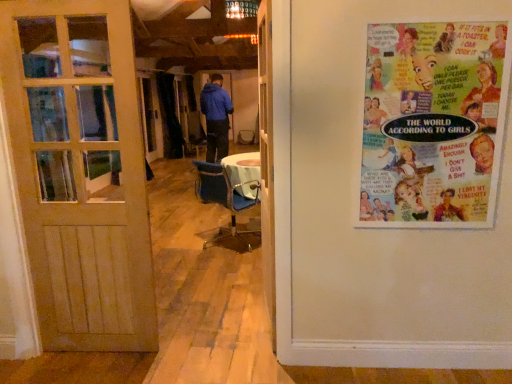
Question: Is blue fabric chair at center with white wooden door at center, acting as the 2th door starting from the left?

Choices:
 (A) yes
 (B) no

Answer: (B)

Question: Does blue fabric chair at center appear on the left side of white wooden door at center, the first door from the right?

Choices:
 (A) yes
 (B) no

Answer: (A)

Question: Could you tell me if blue fabric chair at center is facing white wooden door at center, acting as the 2th door starting from the left?

Choices:
 (A) no
 (B) yes

Answer: (A)

Question: Considering the relative positions of blue fabric chair at center and white wooden door at center, the first door from the right, in the image provided, is blue fabric chair at center to the right of white wooden door at center, the first door from the right, from the viewer's perspective?

Choices:
 (A) yes
 (B) no

Answer: (B)

Question: Is blue fabric chair at center wider than white wooden door at center, acting as the 2th door starting from the left?

Choices:
 (A) yes
 (B) no

Answer: (A)

Question: Is point (34, 175) positioned closer to the camera than point (243, 208)?

Choices:
 (A) closer
 (B) farther

Answer: (A)

Question: Based on their sizes in the image, would you say wooden door at left, which is the 1th door in left-to-right order, is bigger or smaller than blue fabric chair at center?

Choices:
 (A) big
 (B) small

Answer: (B)

Question: From the image's perspective, is wooden door at left, placed as the second door when sorted from right to left, located above or below blue fabric chair at center?

Choices:
 (A) below
 (B) above

Answer: (B)

Question: Is wooden door at left, placed as the second door when sorted from right to left, wider or thinner than blue fabric chair at center?

Choices:
 (A) wide
 (B) thin

Answer: (B)

Question: From a real-world perspective, relative to white wooden door at center, acting as the 2th door starting from the left, is wooden door at left, placed as the second door when sorted from right to left, vertically above or below?

Choices:
 (A) above
 (B) below

Answer: (B)

Question: Is wooden door at left, which is the 1th door in left-to-right order, wider or thinner than white wooden door at center, acting as the 2th door starting from the left?

Choices:
 (A) wide
 (B) thin

Answer: (B)

Question: Is point (37, 317) positioned closer to the camera than point (270, 127)?

Choices:
 (A) farther
 (B) closer

Answer: (A)

Question: Which is correct: wooden door at left, placed as the second door when sorted from right to left, is inside white wooden door at center, acting as the 2th door starting from the left, or outside of it?

Choices:
 (A) inside
 (B) outside

Answer: (B)

Question: Looking at the image, does white wooden door at center, acting as the 2th door starting from the left, seem bigger or smaller compared to blue fabric chair at center?

Choices:
 (A) small
 (B) big

Answer: (A)

Question: Would you say white wooden door at center, the first door from the right, is inside or outside blue fabric chair at center?

Choices:
 (A) outside
 (B) inside

Answer: (A)